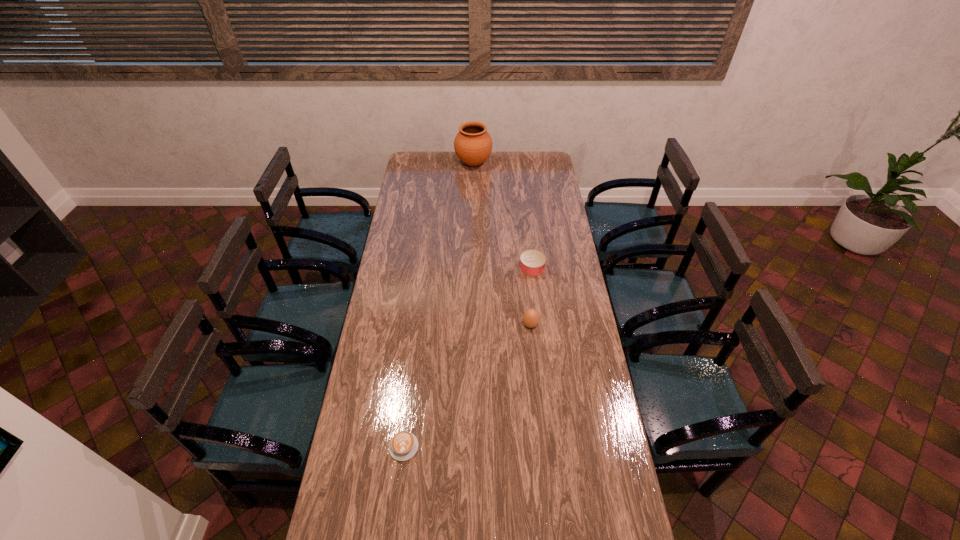
Locate an element on the screen. pottery is located at coordinates (473, 144).

The height and width of the screenshot is (540, 960). I want to click on the farthest object, so click(473, 144).

Where is `the second tallest object`? This screenshot has height=540, width=960. the second tallest object is located at coordinates (x=530, y=318).

Locate an element on the screen. boiled egg is located at coordinates (530, 318).

The width and height of the screenshot is (960, 540). Find the location of `can`. can is located at coordinates (532, 262).

Where is `the second shortest object`? the second shortest object is located at coordinates (532, 262).

Locate an element on the screen. The height and width of the screenshot is (540, 960). the shortest object is located at coordinates (404, 445).

I want to click on the nearest object, so click(404, 445).

Identify the location of free spot located 0.280m on the right of the pottery. (539, 163).

The height and width of the screenshot is (540, 960). I want to click on free space located on the front of the boiled egg, so click(x=532, y=346).